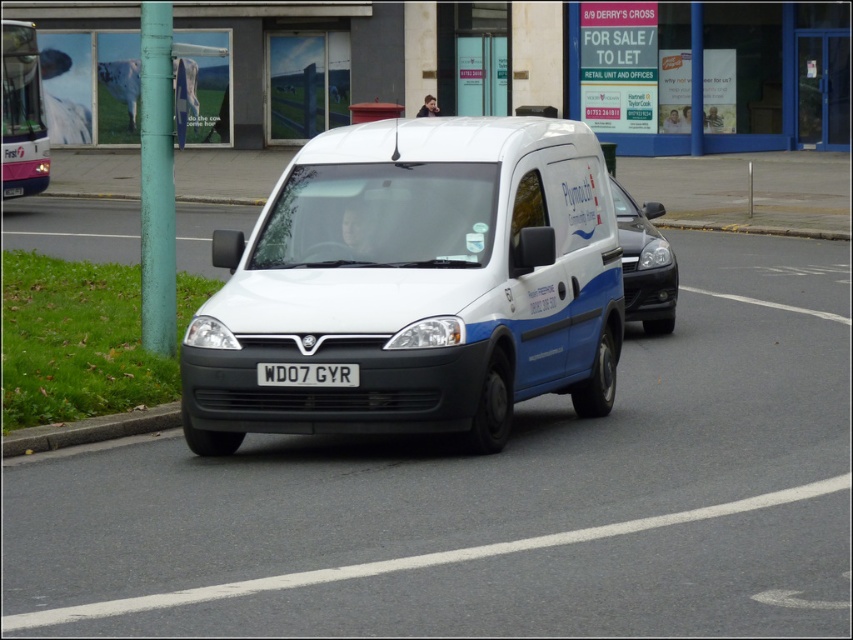
Based on the scene description, what object is located at the coordinates point (415,284)?

The point (415,284) corresponds to the white matte van at center.

Looking at this image, you are standing at the position of the van and want to move towards the building. Which point, point (619, 218) or point (334, 372), is closer to you as you face the building?

Point (619, 218) is closer to you because it is further to the viewer than point (334, 372), meaning it is nearer in your current position facing the building.

You are a delivery driver who needs to park your van near the building with the blue door and red mailbox. There is a pink plastic bus at upper left and a glossy black car at center blocking the parking spot. Can you park your van there?

The pink plastic bus at upper left is positioned over the glossy black car at center, meaning the pink plastic bus is blocking the glossy black car. Since both vehicles are blocking the parking spot, you cannot park your van there.